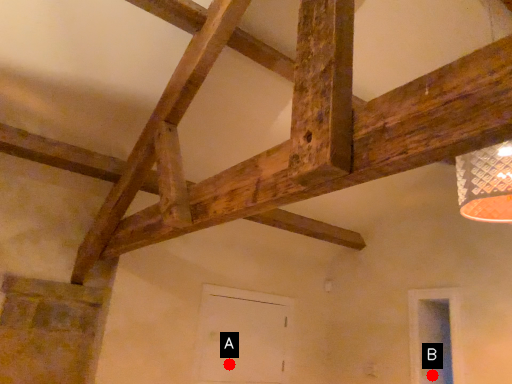
Question: Two points are circled on the image, labeled by A and B beside each circle. Which of the following is the farthest from the observer?

Choices:
 (A) A is further
 (B) B is further

Answer: (A)